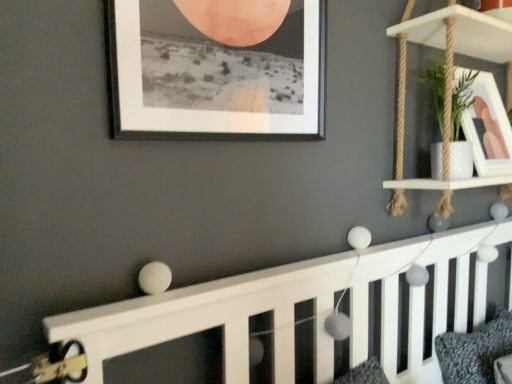
Question: Is textured gray pillow at lower right to the right of white wood shelf at upper right from the viewer's perspective?

Choices:
 (A) no
 (B) yes

Answer: (B)

Question: Is white wood shelf at upper right at the back of textured gray pillow at lower right?

Choices:
 (A) no
 (B) yes

Answer: (A)

Question: Is the position of textured gray pillow at lower right less distant than that of white wood shelf at upper right?

Choices:
 (A) yes
 (B) no

Answer: (B)

Question: Does textured gray pillow at lower right have a lesser height compared to white wood shelf at upper right?

Choices:
 (A) yes
 (B) no

Answer: (A)

Question: Is white wood shelf at upper right located within textured gray pillow at lower right?

Choices:
 (A) no
 (B) yes

Answer: (A)

Question: Is textured gray pillow at lower right inside or outside of white glossy picture frame at upper right, arranged as the 2th picture frame when viewed from the left?

Choices:
 (A) inside
 (B) outside

Answer: (B)

Question: Considering the positions of textured gray pillow at lower right and white glossy picture frame at upper right, acting as the 2th picture frame starting from the front, in the image, is textured gray pillow at lower right taller or shorter than white glossy picture frame at upper right, acting as the 2th picture frame starting from the front,?

Choices:
 (A) short
 (B) tall

Answer: (A)

Question: Considering the positions of textured gray pillow at lower right and white glossy picture frame at upper right, arranged as the 2th picture frame when viewed from the left, in the image, is textured gray pillow at lower right wider or thinner than white glossy picture frame at upper right, arranged as the 2th picture frame when viewed from the left,?

Choices:
 (A) wide
 (B) thin

Answer: (A)

Question: From a real-world perspective, is textured gray pillow at lower right positioned above or below white glossy picture frame at upper right, marked as the first picture frame in a back-to-front arrangement?

Choices:
 (A) below
 (B) above

Answer: (A)

Question: In the image, is textured gray pillow at lower right positioned in front of or behind black matte picture frame at upper center, positioned as the 1th picture frame in front-to-back order?

Choices:
 (A) behind
 (B) front

Answer: (A)

Question: Does point (458, 350) appear closer or farther from the camera than point (242, 119)?

Choices:
 (A) closer
 (B) farther

Answer: (B)

Question: Is textured gray pillow at lower right inside the boundaries of black matte picture frame at upper center, the first picture frame positioned from the left, or outside?

Choices:
 (A) inside
 (B) outside

Answer: (B)

Question: From the image's perspective, is textured gray pillow at lower right positioned above or below black matte picture frame at upper center, positioned as the 2th picture frame in back-to-front order?

Choices:
 (A) above
 (B) below

Answer: (B)

Question: Which is correct: black matte picture frame at upper center, positioned as the 1th picture frame in front-to-back order, is inside white wood shelf at upper right, or outside of it?

Choices:
 (A) outside
 (B) inside

Answer: (A)

Question: Looking at their shapes, would you say black matte picture frame at upper center, the first picture frame positioned from the left, is wider or thinner than white wood shelf at upper right?

Choices:
 (A) wide
 (B) thin

Answer: (B)